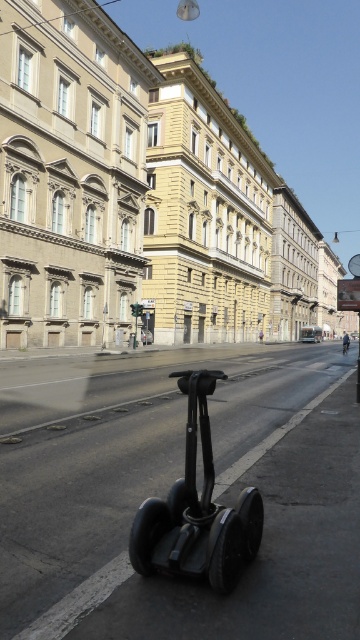
Question: Which point is closer to the camera taking this photo?

Choices:
 (A) (318, 340)
 (B) (189, 371)

Answer: (B)

Question: Which of the following is the closest to the observer?

Choices:
 (A) green metallic bus at center
 (B) black rubber scooter at center

Answer: (B)

Question: Does black rubber scooter at center have a smaller size compared to green metallic bus at center?

Choices:
 (A) yes
 (B) no

Answer: (A)

Question: Is black rubber scooter at center above green metallic bus at center?

Choices:
 (A) no
 (B) yes

Answer: (B)

Question: Considering the relative positions of black rubber scooter at center and green metallic bus at center in the image provided, where is black rubber scooter at center located with respect to green metallic bus at center?

Choices:
 (A) right
 (B) left

Answer: (B)